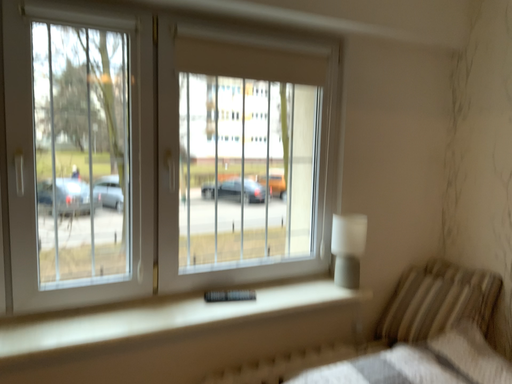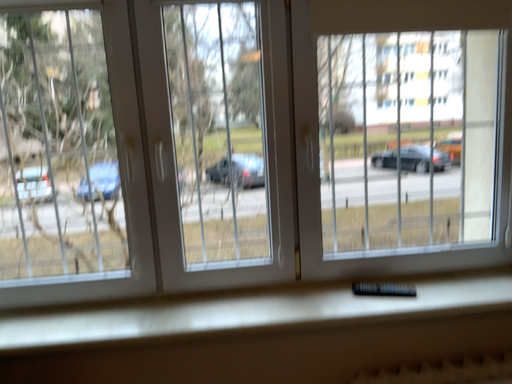
Question: How did the camera likely rotate when shooting the video?

Choices:
 (A) rotated right
 (B) rotated left

Answer: (B)